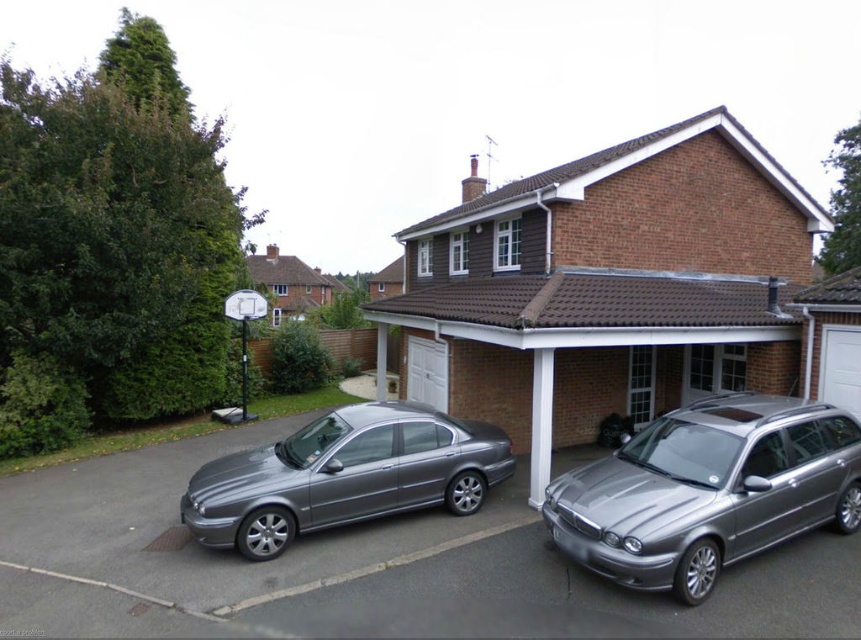
You are a GUI agent. You are given a task and a screenshot of the screen. Output one action in this format:
    pyautogui.click(x=<x>, y=<y>)
    Task: Click on the brown brick garage at center
    
    Given the screenshot: What is the action you would take?
    pyautogui.click(x=606, y=285)

Does point (488, 413) come closer to viewer compared to point (488, 545)?

No, (488, 413) is behind (488, 545).

Is point (530, 496) less distant than point (612, 600)?

No, (530, 496) is behind (612, 600).

This screenshot has height=640, width=861. I want to click on brown brick garage at center, so click(606, 285).

Does brown brick garage at center have a smaller size compared to satin silver sedan at center?

No, brown brick garage at center is not smaller than satin silver sedan at center.

Is brown brick garage at center wider than satin silver sedan at center?

Indeed, brown brick garage at center has a greater width compared to satin silver sedan at center.

Find the location of a particular element. brown brick garage at center is located at coordinates (606, 285).

What are the coordinates of `brown brick garage at center` in the screenshot? It's located at (606, 285).

How much distance is there between satin silver car at center and satin silver sedan at center?

A distance of 1.13 meters exists between satin silver car at center and satin silver sedan at center.

Between satin silver car at center and satin silver sedan at center, which one is positioned lower?

satin silver car at center

Identify the location of satin silver car at center. (370, 564).